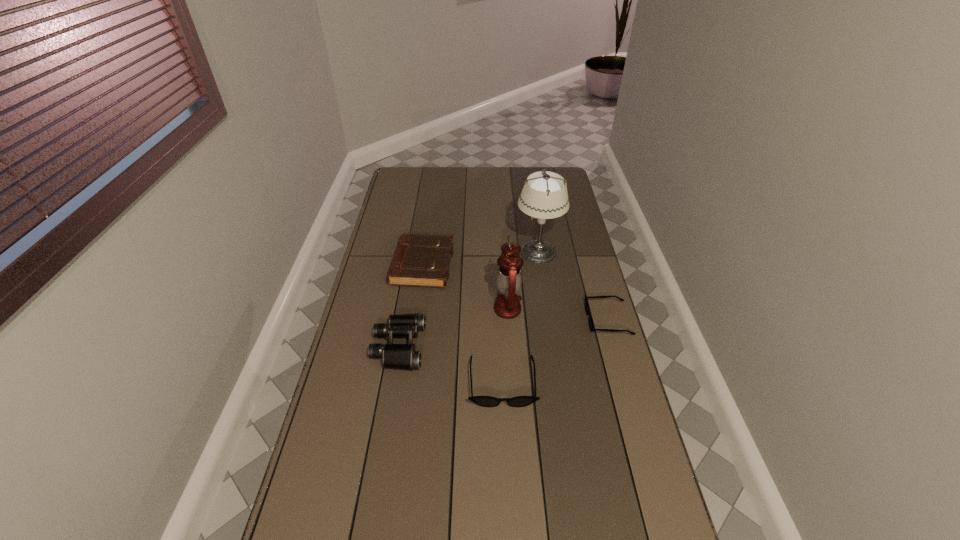
Locate an element on the screen. Image resolution: width=960 pixels, height=540 pixels. sunglasses that is at the right edge is located at coordinates (591, 325).

You are a GUI agent. You are given a task and a screenshot of the screen. Output one action in this format:
    pyautogui.click(x=<x>, y=<y>)
    Task: Click on the lampshade that is at the right edge
    This screenshot has width=960, height=540.
    Given the screenshot: What is the action you would take?
    pyautogui.click(x=544, y=196)

This screenshot has width=960, height=540. Find the location of `free space at the far edge`. free space at the far edge is located at coordinates (473, 188).

Where is `vacant position at the near edge of the desktop`? This screenshot has width=960, height=540. vacant position at the near edge of the desktop is located at coordinates (522, 526).

At what (x,y) coordinates should I click in order to perform the action: click on vacant position at the left edge of the desktop. Please return your answer as a coordinate pair (x, y). Looking at the image, I should click on (369, 282).

Locate an element on the screen. vacant space at the right edge is located at coordinates (600, 390).

I want to click on free space between the fourth shortest object and the nearer sunglasses, so click(x=450, y=364).

You are a GUI agent. You are given a task and a screenshot of the screen. Output one action in this format:
    pyautogui.click(x=<x>, y=<y>)
    Task: Click on the vacant space in between the hardback book and the lampshade
    
    Given the screenshot: What is the action you would take?
    pyautogui.click(x=480, y=258)

Find the location of a particular element. The image size is (960, 540). free space that is in between the nearer sunglasses and the hardback book is located at coordinates (463, 324).

The image size is (960, 540). What are the coordinates of `vacant space that's between the shortest object and the binoculars` in the screenshot? It's located at (503, 333).